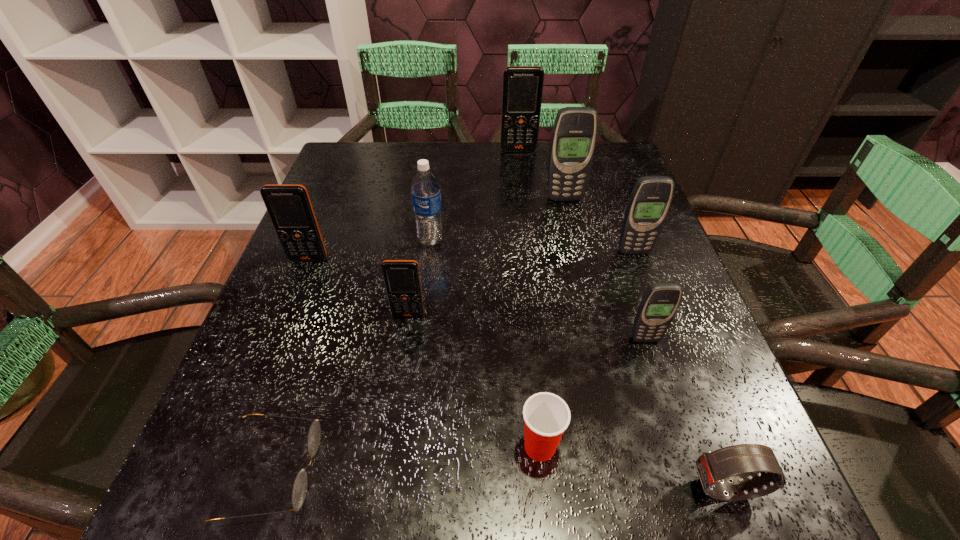
What are the coordinates of `the biggest orange cellular telephone` in the screenshot? It's located at (522, 90).

You are a GUI agent. You are given a task and a screenshot of the screen. Output one action in this format:
    pyautogui.click(x=<x>, y=<y>)
    Task: Click on the farthest object
    
    Given the screenshot: What is the action you would take?
    pyautogui.click(x=522, y=90)

The height and width of the screenshot is (540, 960). In order to click on the ninth nearest object in this screenshot , I will do `click(574, 134)`.

Identify the location of the leftmost gray cellular telephone. (574, 134).

Where is `water bottle`? water bottle is located at coordinates pos(425,189).

This screenshot has height=540, width=960. I want to click on the third farthest cellular telephone, so click(650, 200).

Identify the location of the second nearest gray cellular telephone. (650, 200).

Locate an element on the screen. Image resolution: width=960 pixels, height=540 pixels. the leftmost orange cellular telephone is located at coordinates (289, 206).

At what (x,y) coordinates should I click in order to perform the action: click on the second nearest orange cellular telephone. Please return your answer as a coordinate pair (x, y). Looking at the image, I should click on (289, 206).

This screenshot has width=960, height=540. What are the coordinates of `the smallest orange cellular telephone` in the screenshot? It's located at (402, 281).